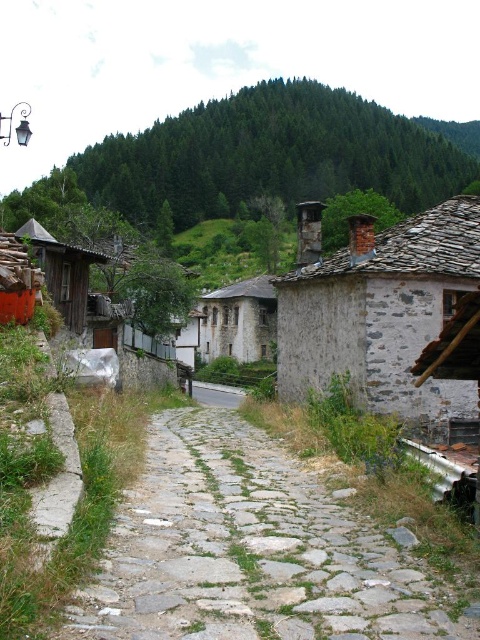
Is point (175, 515) closer to viewer compared to point (245, 323)?

Yes, it is in front of point (245, 323).

Can you confirm if gray stone path at center is positioned above stone textured house at center?

Actually, gray stone path at center is below stone textured house at center.

Locate an element on the screen. The width and height of the screenshot is (480, 640). gray stone path at center is located at coordinates (249, 550).

Image resolution: width=480 pixels, height=640 pixels. I want to click on stone chimney at right, so click(381, 314).

Between point (404, 323) and point (203, 401), which one is positioned behind?

The point (203, 401) is more distant.

What do you see at coordinates (381, 314) in the screenshot? The width and height of the screenshot is (480, 640). I see `stone chimney at right` at bounding box center [381, 314].

Find the location of a particular element. stone chimney at right is located at coordinates (381, 314).

Does point (165, 422) come farther from viewer compared to point (454, 276)?

That is True.

This screenshot has width=480, height=640. Find the location of `gray stone path at center`. gray stone path at center is located at coordinates (249, 550).

Identify the location of gray stone path at center. The width and height of the screenshot is (480, 640). (249, 550).